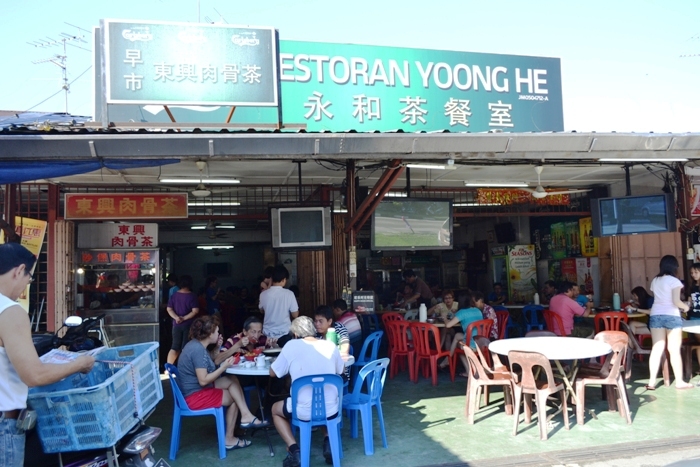
At what (x,y) coordinates should I click in order to perform the action: click on refridgerator. Please return your answer as a coordinate pair (x, y). Looking at the image, I should click on (145, 319).